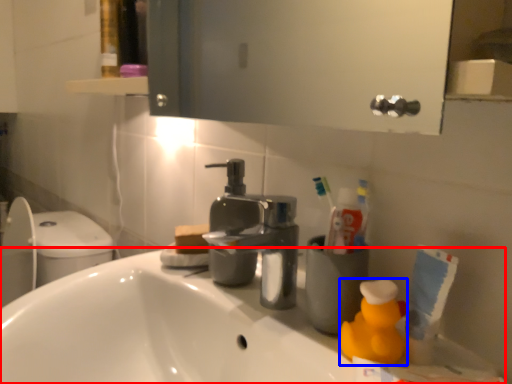
Question: Among these objects, which one is farthest to the camera, counter top (highlighted by a red box) or cleaning product (highlighted by a blue box)?

Choices:
 (A) counter top
 (B) cleaning product

Answer: (B)